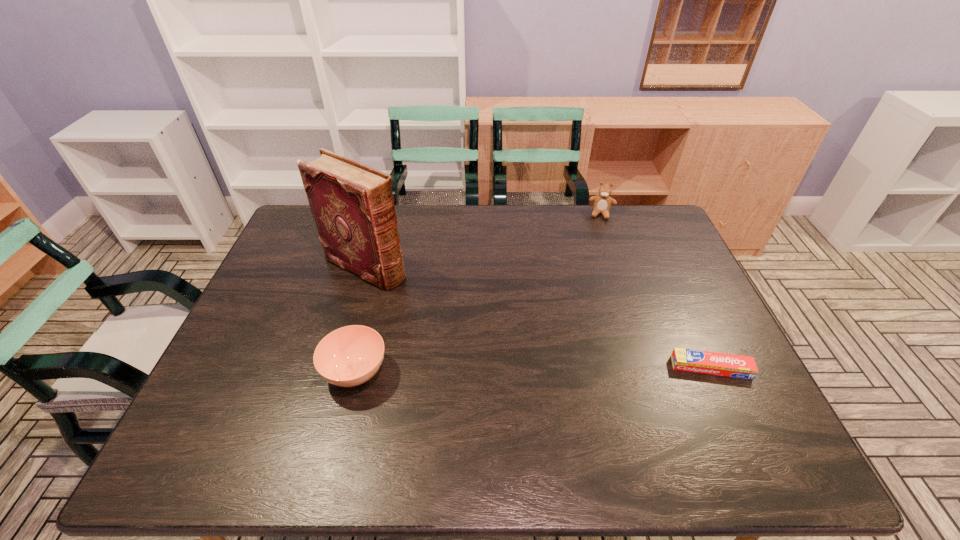
The image size is (960, 540). Find the location of `vacant space located 0.270m on the spine side of the third nearest object`. vacant space located 0.270m on the spine side of the third nearest object is located at coordinates (470, 318).

Identify the location of vacant space located 0.120m on the front-facing side of the farthest object. The height and width of the screenshot is (540, 960). (598, 241).

What are the coordinates of `vacant space located on the front-facing side of the farthest object` in the screenshot? It's located at (593, 282).

Where is `vacant space located on the front-facing side of the farthest object`? vacant space located on the front-facing side of the farthest object is located at coordinates (591, 293).

Where is `hardback book that is positioned at the far edge`? This screenshot has width=960, height=540. hardback book that is positioned at the far edge is located at coordinates (352, 204).

This screenshot has width=960, height=540. Find the location of `teddy bear at the far edge`. teddy bear at the far edge is located at coordinates (602, 202).

Find the location of a particular element. The height and width of the screenshot is (540, 960). object at the near edge is located at coordinates (349, 356).

Locate an element on the screen. object that is at the left edge is located at coordinates (352, 204).

Locate an element on the screen. This screenshot has width=960, height=540. object present at the right edge is located at coordinates (706, 362).

Find the location of a particular element. The image size is (960, 540). object that is positioned at the far left corner is located at coordinates click(352, 204).